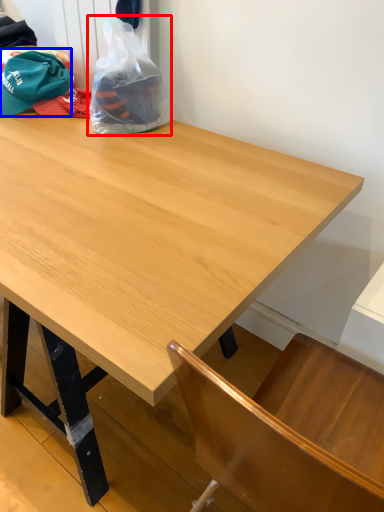
Question: Among these objects, which one is farthest to the camera, plastic bag (highlighted by a red box) or baseball hat (highlighted by a blue box)?

Choices:
 (A) plastic bag
 (B) baseball hat

Answer: (B)